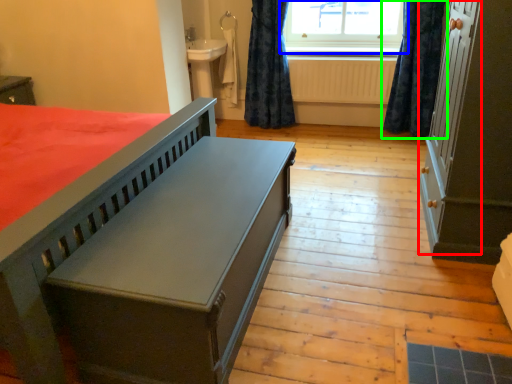
Question: Which object is positioned closest to screen door (highlighted by a red box)? Select from window (highlighted by a blue box) and curtain (highlighted by a green box).

Choices:
 (A) window
 (B) curtain

Answer: (B)